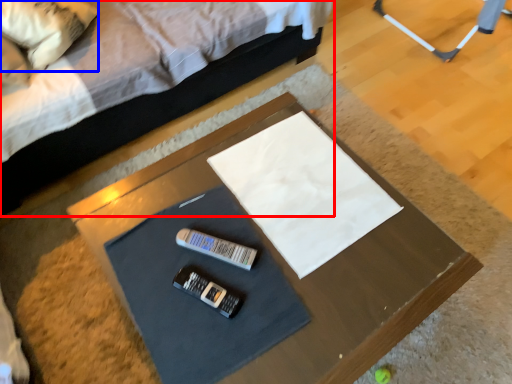
Question: Which object appears closest to the camera in this image, bed (highlighted by a red box) or pillow (highlighted by a blue box)?

Choices:
 (A) bed
 (B) pillow

Answer: (A)